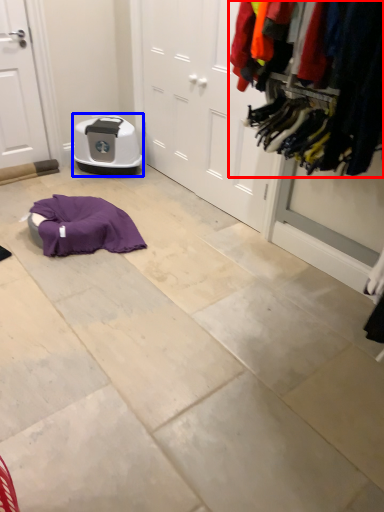
Question: Which point is further to the camera, closet (highlighted by a red box) or appliance (highlighted by a blue box)?

Choices:
 (A) closet
 (B) appliance

Answer: (B)